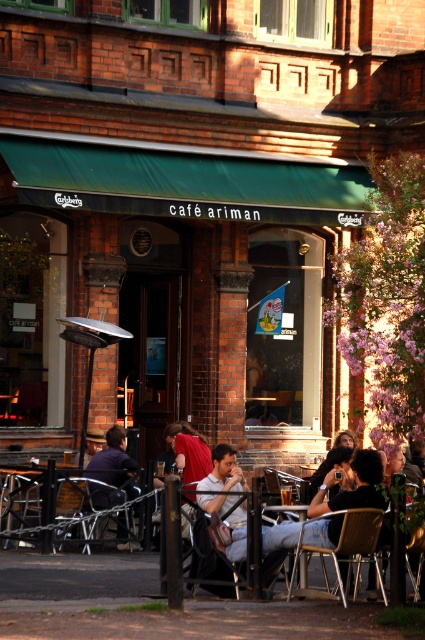
You are a customer at the cafe and want to sit down. You see the matte black jacket at center and the metallic gold chair at lower center. Is the jacket currently on the chair?

Yes, the matte black jacket at center is positioned over the metallic gold chair at lower center, so the jacket is currently on the chair.

You are a customer entering the cafe and need to choose between the matte black jacket at center and the metallic gold chair at lower center to place your bag. Which one has enough height to prevent your bag from touching the floor?

The matte black jacket at center is taller than the metallic gold chair at lower center, so placing the bag on the matte black jacket at center would prevent it from touching the floor.